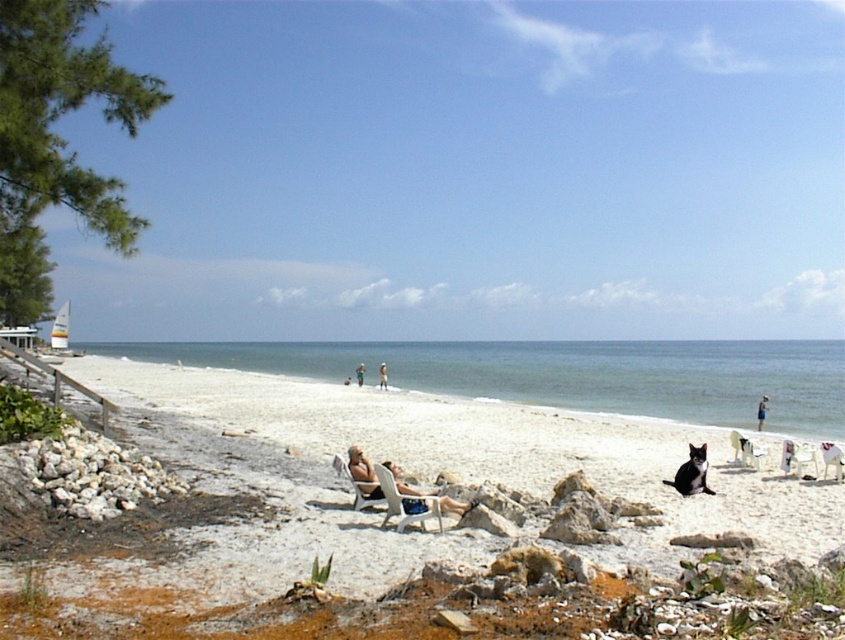
Question: Which of these objects is positioned farthest from the tan skin person at center?

Choices:
 (A) blue fabric person at lower center
 (B) metallic silver chair at lower center
 (C) white sand beach at lower center
 (D) light brown wooden chair at center

Answer: (C)

Question: Which point is farther to the camera?

Choices:
 (A) white sand beach at lower center
 (B) light brown wooden chair at center
 (C) white plastic beach chair at center

Answer: (B)

Question: Is white plastic beach chair at center smaller than light brown wooden chair at center?

Choices:
 (A) no
 (B) yes

Answer: (B)

Question: Is white sand beach at lower center thinner than matte black lounge chair at center?

Choices:
 (A) yes
 (B) no

Answer: (B)

Question: Does white sand beach at center appear on the left side of metallic silver chair at lower center?

Choices:
 (A) no
 (B) yes

Answer: (B)

Question: Among these objects, which one is farthest from the camera?

Choices:
 (A) tan skin person at center
 (B) metallic silver chair at lower center
 (C) blue fabric person at lower center
 (D) matte black lounge chair at center

Answer: (A)